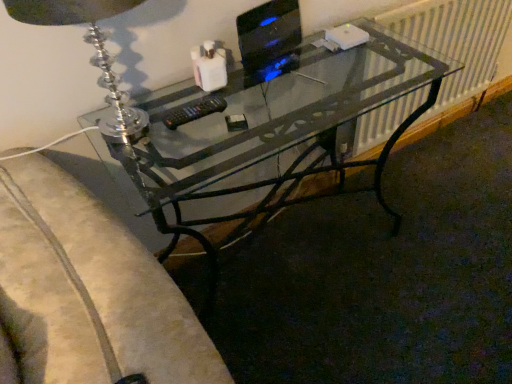
Identify the location of free space in front of black glossy monitor at upper right. [286, 96].